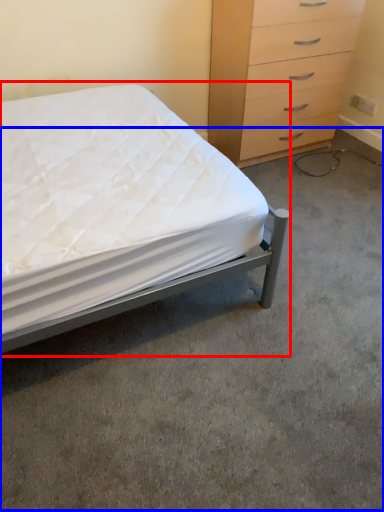
Question: Among these objects, which one is farthest to the camera, bed (highlighted by a red box) or concrete (highlighted by a blue box)?

Choices:
 (A) bed
 (B) concrete

Answer: (B)